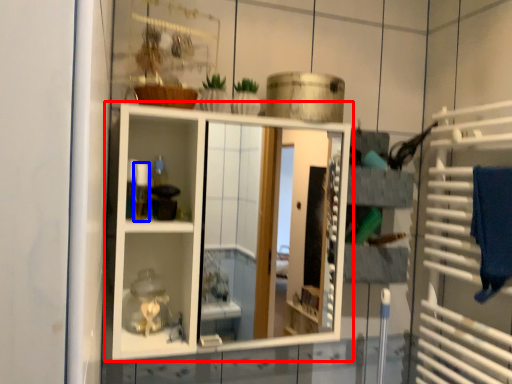
Question: Which of the following is the farthest to the observer, shelf (highlighted by a red box) or toiletry (highlighted by a blue box)?

Choices:
 (A) shelf
 (B) toiletry

Answer: (B)